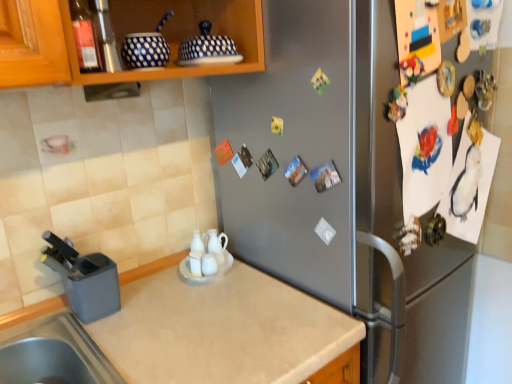
Question: Relative to translucent glass bottle at upper left, is satin silver fridge at center in front or behind?

Choices:
 (A) behind
 (B) front

Answer: (B)

Question: In the image, is satin silver fridge at center on the left side or the right side of translucent glass bottle at upper left?

Choices:
 (A) left
 (B) right

Answer: (B)

Question: Estimate the real-world distances between objects in this image. Which object is farther from the satin silver fridge at center?

Choices:
 (A) gray plastic knife block at lower left, which is the 1th appliance from left to right
 (B) beige laminate countertop at lower left
 (C) white glossy tea pot at center
 (D) translucent glass bottle at upper left
 (E) polka dot ceramic jar at upper center, which is counted as the 2th appliance, starting from the right

Answer: (D)

Question: Estimate the real-world distances between objects in this image. Which object is closer to the polka dot ceramic dish cover at upper center, which is the first appliance in top-to-bottom order?

Choices:
 (A) white glossy tea pot at center
 (B) polka dot ceramic jar at upper center, which is counted as the 2th appliance, starting from the right
 (C) gray plastic knife block at lower left, positioned as the third appliance in right-to-left order
 (D) translucent glass bottle at upper left
 (E) beige laminate countertop at lower left

Answer: (B)